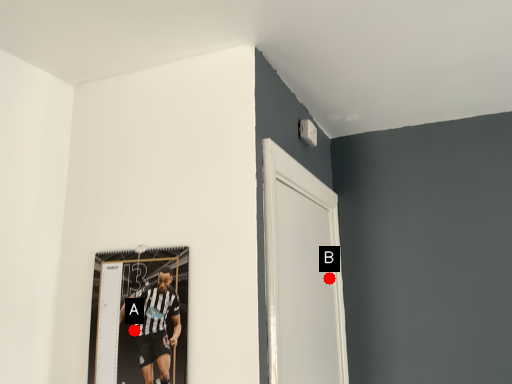
Question: Two points are circled on the image, labeled by A and B beside each circle. Which point is further to the camera?

Choices:
 (A) A is further
 (B) B is further

Answer: (B)